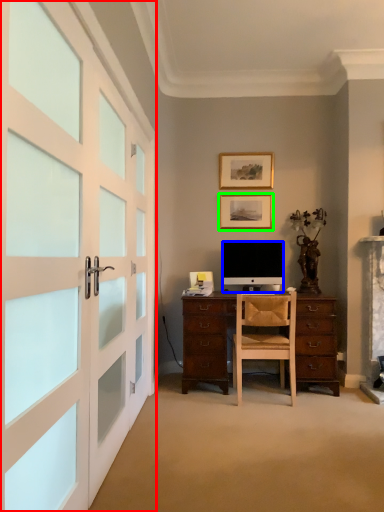
Question: Which object is the farthest from garage door (highlighted by a red box)? Choose among these: television (highlighted by a blue box) or picture frame (highlighted by a green box).

Choices:
 (A) television
 (B) picture frame

Answer: (B)